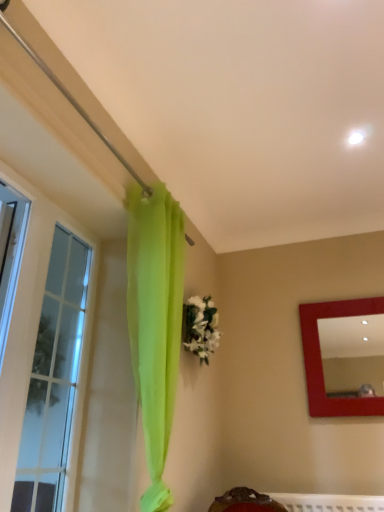
This screenshot has width=384, height=512. What do you see at coordinates (352, 353) in the screenshot?
I see `matte red mirror at upper right` at bounding box center [352, 353].

The image size is (384, 512). What do you see at coordinates (36, 334) in the screenshot?
I see `clear glass window at left` at bounding box center [36, 334].

Measure the distance between point (39, 228) and camera.

They are 5.68 feet apart.

Locate an element on the screen. This screenshot has height=512, width=384. matte red mirror at upper right is located at coordinates (352, 353).

Locate an element on the screen. The height and width of the screenshot is (512, 384). flower above the matte red mirror at upper right (from the image's perspective) is located at coordinates click(200, 327).

Measure the distance between white matte floral arrangement at center and matte red mirror at upper right.

white matte floral arrangement at center is 32.08 inches from matte red mirror at upper right.

From a real-world perspective, between white matte floral arrangement at center and matte red mirror at upper right, who is vertically lower?

In real-world perspective, matte red mirror at upper right is lower.

Is matte red mirror at upper right at the back of clear glass window at left?

No, clear glass window at left's orientation is not away from matte red mirror at upper right.

Is there a large distance between clear glass window at left and matte red mirror at upper right?

Yes.

From the image's perspective, is clear glass window at left above or below matte red mirror at upper right?

From the image's perspective, clear glass window at left appears above matte red mirror at upper right.

Considering the positions of objects clear glass window at left and matte red mirror at upper right in the image provided, who is in front, clear glass window at left or matte red mirror at upper right?

clear glass window at left.

Is point (344, 325) closer or farther from the camera than point (0, 462)?

Point (344, 325) is positioned farther from the camera compared to point (0, 462).

Does matte red mirror at upper right have a greater height compared to clear glass window at left?

Incorrect, the height of matte red mirror at upper right is not larger of that of clear glass window at left.

Is matte red mirror at upper right positioned beyond the bounds of clear glass window at left?

Absolutely, matte red mirror at upper right is external to clear glass window at left.

Is matte red mirror at upper right located outside white matte floral arrangement at center?

matte red mirror at upper right lies outside white matte floral arrangement at center's area.

Is matte red mirror at upper right in front of or behind white matte floral arrangement at center in the image?

matte red mirror at upper right is positioned farther from the viewer than white matte floral arrangement at center.

Identify the location of mirror below the white matte floral arrangement at center (from the image's perspective). The height and width of the screenshot is (512, 384). (352, 353).

From a real-world perspective, relative to white matte floral arrangement at center, is matte red mirror at upper right vertically above or below?

From a real-world perspective, matte red mirror at upper right is physically below white matte floral arrangement at center.

Which is correct: white matte floral arrangement at center is inside clear glass window at left, or outside of it?

white matte floral arrangement at center exists outside the volume of clear glass window at left.

Considering the relative sizes of white matte floral arrangement at center and clear glass window at left in the image provided, is white matte floral arrangement at center bigger than clear glass window at left?

Incorrect, white matte floral arrangement at center is not larger than clear glass window at left.

Considering the positions of objects white matte floral arrangement at center and clear glass window at left in the image provided, who is more to the right, white matte floral arrangement at center or clear glass window at left?

From the viewer's perspective, white matte floral arrangement at center appears more on the right side.

Is white matte floral arrangement at center aimed at clear glass window at left?

No, white matte floral arrangement at center does not turn towards clear glass window at left.

What are the coordinates of `window directly beneath the white matte floral arrangement at center (from a real-world perspective)` in the screenshot? It's located at (36, 334).

Is point (46, 244) less distant than point (212, 341)?

Yes, point (46, 244) is in front of point (212, 341).

Who is taller, clear glass window at left or white matte floral arrangement at center?

clear glass window at left.

This screenshot has height=512, width=384. I want to click on flower in front of the matte red mirror at upper right, so click(x=200, y=327).

In the image, there is a matte red mirror at upper right. Where is `window above it (from the image's perspective)`? The image size is (384, 512). window above it (from the image's perspective) is located at coordinates (36, 334).

Based on their spatial positions, is clear glass window at left or white matte floral arrangement at center closer to matte red mirror at upper right?

Based on the image, white matte floral arrangement at center appears to be nearer to matte red mirror at upper right.

From the image, which object appears to be farther from white matte floral arrangement at center, matte red mirror at upper right or clear glass window at left?

matte red mirror at upper right is further to white matte floral arrangement at center.

From the image, which object appears to be farther from clear glass window at left, matte red mirror at upper right or white matte floral arrangement at center?

matte red mirror at upper right is positioned further to the anchor clear glass window at left.

From the image, which object appears to be farther from white matte floral arrangement at center, clear glass window at left or matte red mirror at upper right?

matte red mirror at upper right lies further to white matte floral arrangement at center than the other object.

From the image, which object appears to be nearer to matte red mirror at upper right, white matte floral arrangement at center or clear glass window at left?

Among the two, white matte floral arrangement at center is located nearer to matte red mirror at upper right.

Based on their spatial positions, is white matte floral arrangement at center or matte red mirror at upper right closer to clear glass window at left?

white matte floral arrangement at center is closer to clear glass window at left.

Identify the location of flower located between clear glass window at left and matte red mirror at upper right in the left-right direction. (200, 327).